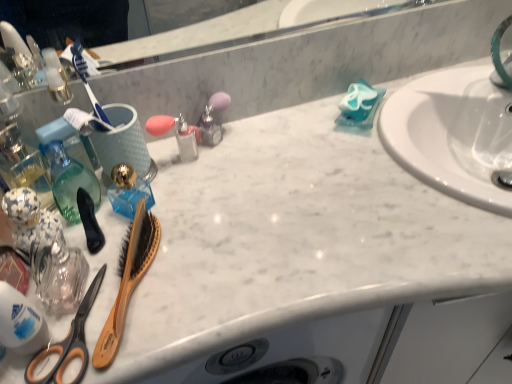
Where is `vacant space to the right of translucent glass bottle at left`? vacant space to the right of translucent glass bottle at left is located at coordinates (193, 216).